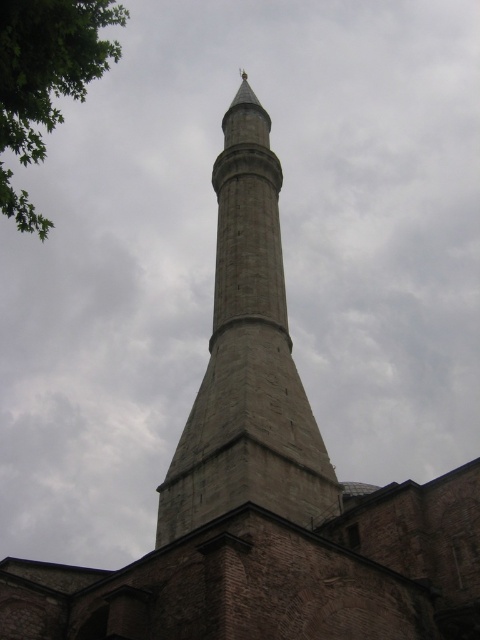
Question: Which object is closer to the camera taking this photo?

Choices:
 (A) green leafy tree at upper left
 (B) gray stone minaret at center

Answer: (A)

Question: Which point appears closest to the camera in this image?

Choices:
 (A) (14, 81)
 (B) (224, 355)

Answer: (A)

Question: Where is gray stone minaret at center located in relation to green leafy tree at upper left in the image?

Choices:
 (A) below
 (B) above

Answer: (A)

Question: Can you confirm if gray stone minaret at center is wider than green leafy tree at upper left?

Choices:
 (A) yes
 (B) no

Answer: (B)

Question: Which of the following is the closest to the observer?

Choices:
 (A) gray stone minaret at center
 (B) green leafy tree at upper left

Answer: (B)

Question: Is gray stone minaret at center below green leafy tree at upper left?

Choices:
 (A) yes
 (B) no

Answer: (A)